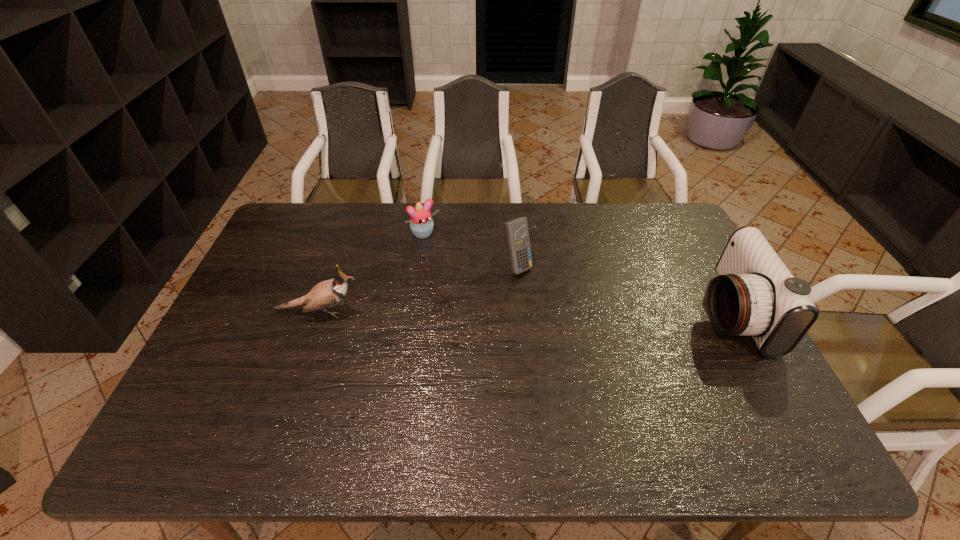
Locate an element on the screen. Image resolution: width=960 pixels, height=540 pixels. vacant space in between the leftmost object and the rightmost object is located at coordinates (524, 312).

This screenshot has height=540, width=960. Find the location of `free space between the leftmost object and the rightmost object`. free space between the leftmost object and the rightmost object is located at coordinates (524, 312).

Identify the location of empty location between the shortest object and the bird. This screenshot has width=960, height=540. (372, 273).

Find the location of a particular element. The width and height of the screenshot is (960, 540). free space that is in between the rightmost object and the calculator is located at coordinates (624, 289).

Identify the location of vacant area that lies between the camcorder and the third object from left to right. The width and height of the screenshot is (960, 540). (624, 289).

Select which object is the closest to the bird. Please provide its 2D coordinates. Your answer should be formatted as a tuple, i.e. [(x, y)], where the tuple contains the x and y coordinates of a point satisfying the conditions above.

[(421, 223)]

Point out which object is positioned as the third nearest to the camcorder. Please provide its 2D coordinates. Your answer should be formatted as a tuple, i.e. [(x, y)], where the tuple contains the x and y coordinates of a point satisfying the conditions above.

[(326, 294)]

Locate an element on the screen. The image size is (960, 540). vacant space that satisfies the following two spatial constraints: 1. on the front side of the rightmost object; 2. on the surface of the farthest object is located at coordinates (413, 313).

The width and height of the screenshot is (960, 540). I want to click on blank space that satisfies the following two spatial constraints: 1. on the front side of the shortest object; 2. on the surface of the camcorder, so click(413, 313).

Find the location of `free space that satisfies the following two spatial constraints: 1. on the front side of the calculator; 2. on the left side of the shortest object`. free space that satisfies the following two spatial constraints: 1. on the front side of the calculator; 2. on the left side of the shortest object is located at coordinates (420, 266).